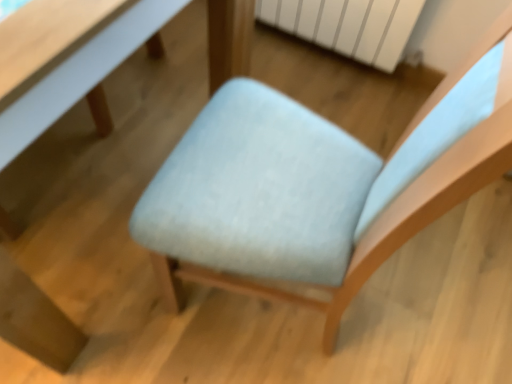
Question: Does point (310, 3) appear closer or farther from the camera than point (159, 1)?

Choices:
 (A) closer
 (B) farther

Answer: (B)

Question: Considering the positions of white matte radiator at upper center and white glossy table at upper left, the first table in the right-to-left sequence, in the image, is white matte radiator at upper center bigger or smaller than white glossy table at upper left, the first table in the right-to-left sequence,?

Choices:
 (A) small
 (B) big

Answer: (A)

Question: Which is nearer to the matte light blue table at center, arranged as the 1th table when viewed from the left?

Choices:
 (A) light blue fabric chair at center
 (B) white glossy table at upper left, acting as the 2th table starting from the left
 (C) white matte radiator at upper center

Answer: (B)

Question: Based on their relative distances, which object is farther from the white matte radiator at upper center?

Choices:
 (A) white glossy table at upper left, acting as the 2th table starting from the left
 (B) light blue fabric chair at center
 (C) matte light blue table at center, arranged as the 1th table when viewed from the left

Answer: (C)